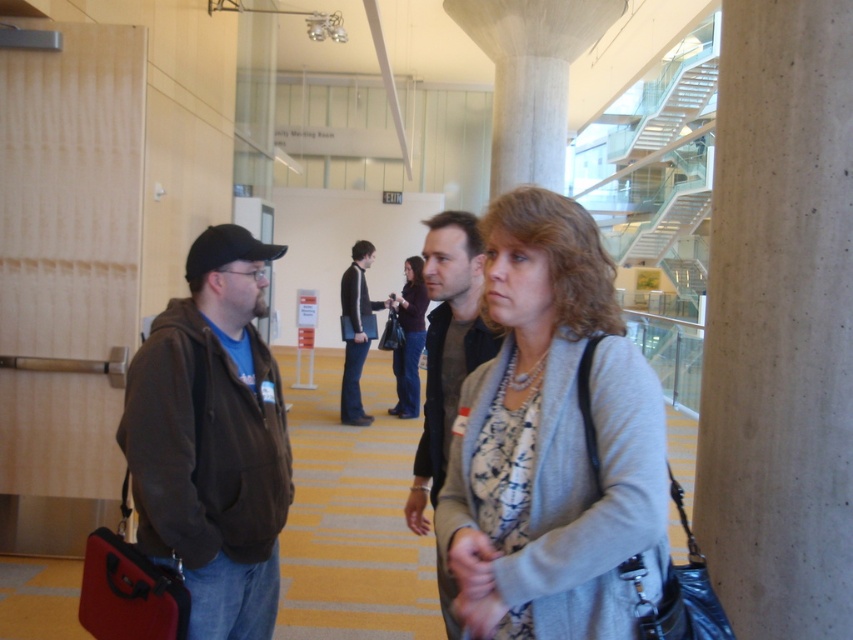
You are a delivery person carrying a large box that is 1.5 meters wide. You need to walk through the space between the concrete at right and the brown fleece jacket at left. Can you fit through the space without tilting the box?

The concrete at right is narrower than the brown fleece jacket at left. Since the space between them is determined by the narrower width of the concrete at right, and the box is 1.5 meters wide, you would need to check if the concrete at right is at least 1.5 meters wide. However, since the concrete at right is less wide than the brown fleece jacket at left, but we don not know the exact width of the concrete, it is uncertain whether the box can fit. Please measure the width of the concrete at right first.

You are a fashion designer observing two sweaters in the scene. The gray knit sweater at center and the matte gray sweater at center. Which one is smaller in size?

The gray knit sweater at center has a smaller size compared to the matte gray sweater at center.

You are standing in the modern building and need to place a heavy object on the floor. The object requires a stable surface. Which area of the floor should you choose, the concrete at right or the striped beige and brown flooring elsewhere?

The concrete at right is a stable surface because it is part of the building structure and is likely more durable than the striped flooring.